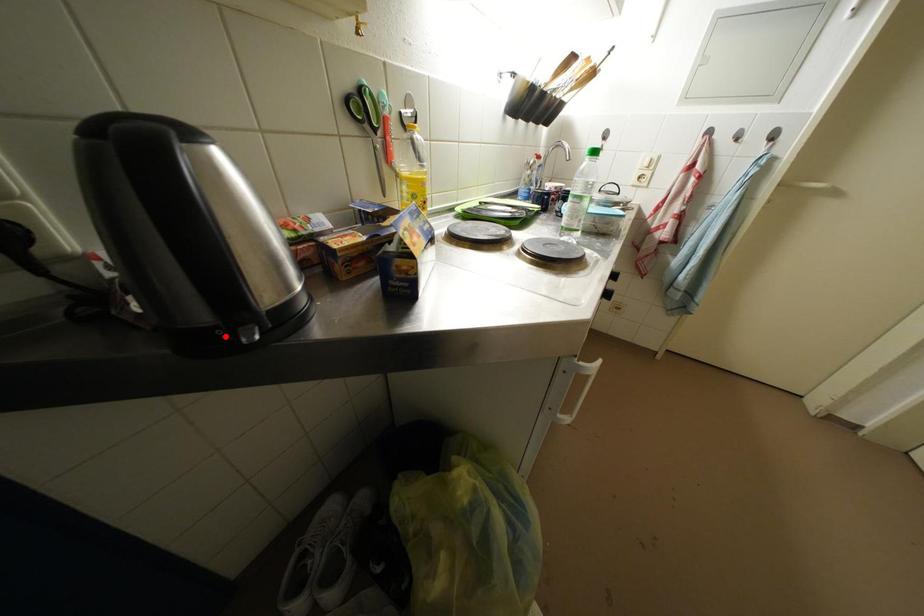
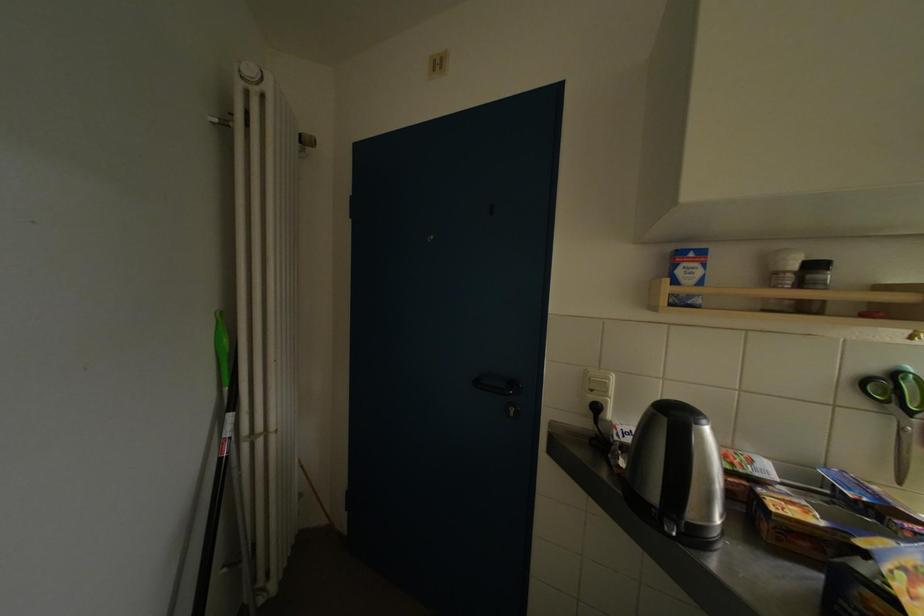
Find the pixel in the second image that matches the highlighted location in the first image.

(661, 514)